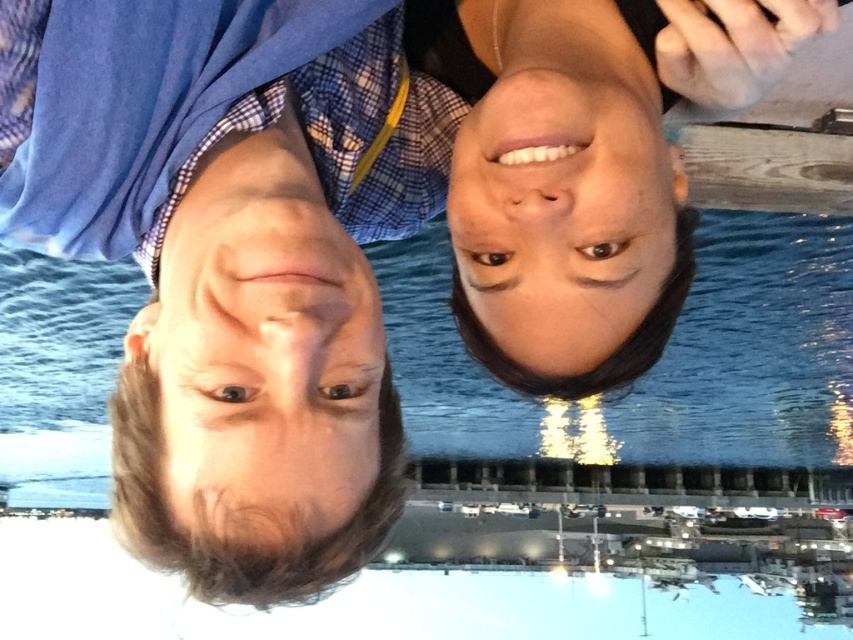
Does point (447, 128) come closer to viewer compared to point (550, 76)?

No, (447, 128) is further to viewer.

Can you confirm if blue plaid shirt at left is positioned below smooth skin face at upper center?

Correct, blue plaid shirt at left is located below smooth skin face at upper center.

Is point (287, 403) more distant than point (537, 236)?

That is False.

In order to click on blue plaid shirt at left in this screenshot , I will do `click(233, 260)`.

Who is positioned more to the right, smooth skin face at center or smooth skin face at upper center?

smooth skin face at upper center is more to the right.

Is smooth skin face at center closer to camera compared to smooth skin face at upper center?

Yes, smooth skin face at center is in front of smooth skin face at upper center.

Find the location of `smooth skin face at center`. smooth skin face at center is located at coordinates (264, 362).

Does point (103, 484) lie in front of point (299, 484)?

That is False.

Can you confirm if blue water at center is positioned above smooth skin face at center?

Actually, blue water at center is below smooth skin face at center.

Is point (590, 464) closer to viewer compared to point (163, 355)?

No, it is not.

The width and height of the screenshot is (853, 640). What are the coordinates of `blue water at center` in the screenshot? It's located at (654, 376).